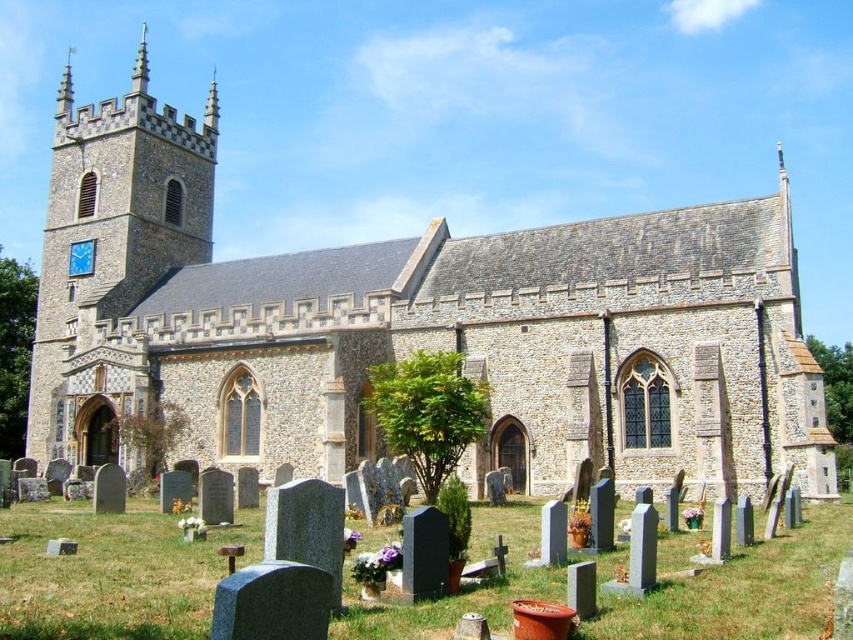
Question: Based on their relative distances, which object is nearer to the smooth stone spire at upper left?

Choices:
 (A) matte brick tower at left
 (B) metallic clock face at upper left

Answer: (A)

Question: Can you confirm if metallic clock face at upper left is positioned below smooth stone spire at upper left?

Choices:
 (A) yes
 (B) no

Answer: (A)

Question: Which object appears farthest from the camera in this image?

Choices:
 (A) metallic clock face at upper left
 (B) matte brick tower at left
 (C) stone church at center
 (D) smooth stone spire at upper left

Answer: (D)

Question: Can you confirm if stone church at center is positioned to the right of metallic clock face at upper left?

Choices:
 (A) yes
 (B) no

Answer: (A)

Question: Which is farther from the stone church at center?

Choices:
 (A) metallic clock face at upper left
 (B) matte brick tower at left
 (C) smooth stone spire at upper left

Answer: (C)

Question: Is stone church at center above smooth stone spire at upper left?

Choices:
 (A) no
 (B) yes

Answer: (A)